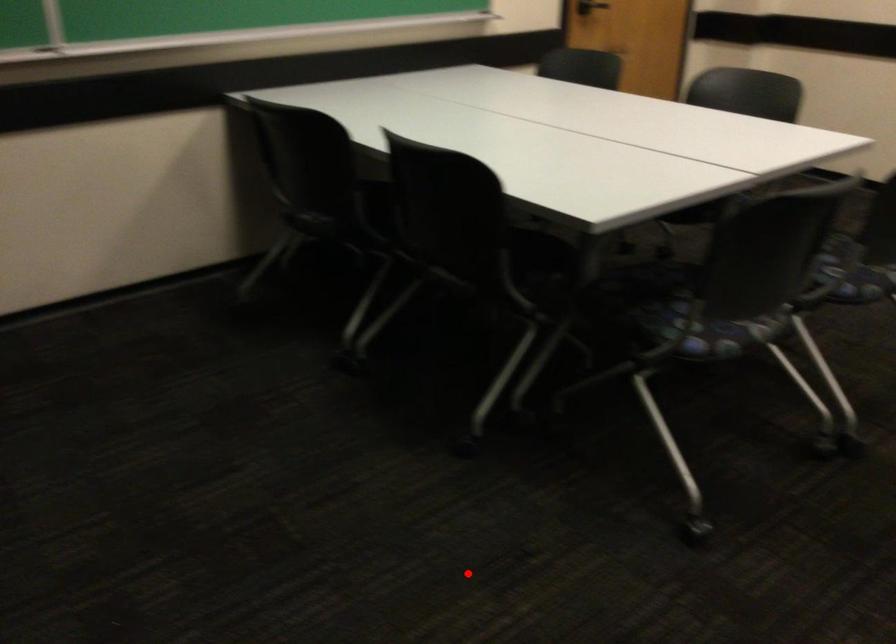
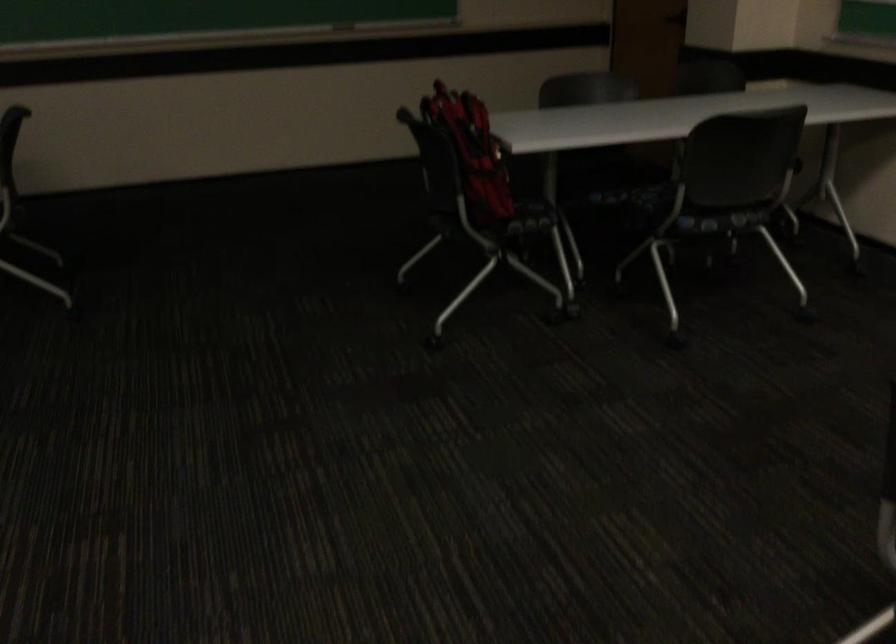
Locate, in the second image, the point that corresponds to the highlighted location in the first image.

(713, 547)